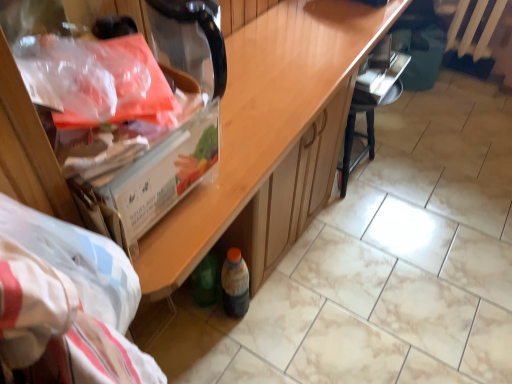
Locate an element on the screen. This screenshot has height=384, width=512. vacant area situated below translucent plastic bag at upper left (from a real-world perspective) is located at coordinates (120, 93).